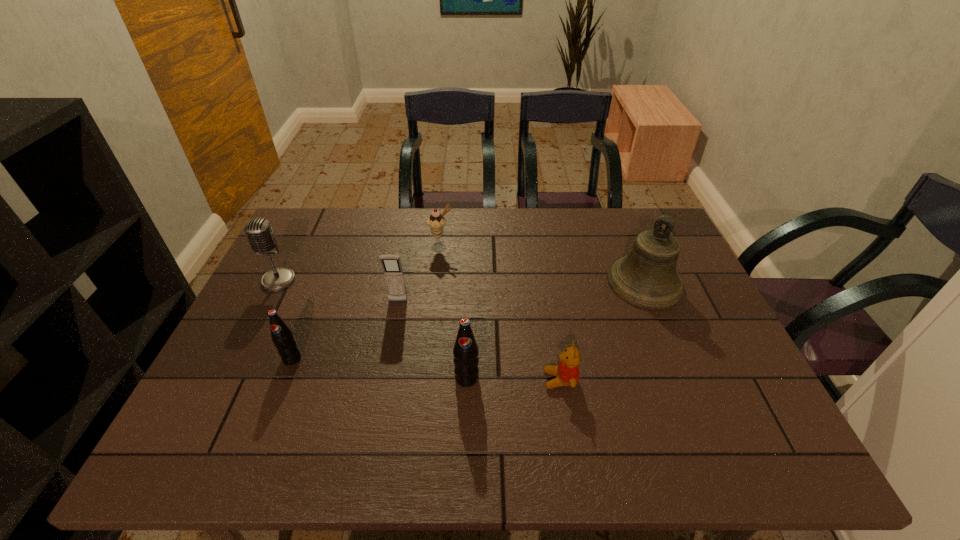
Identify the location of vacant region between the bell and the fourth object from right to left. The height and width of the screenshot is (540, 960). (542, 265).

Locate an element on the screen. This screenshot has width=960, height=540. free space between the shortest object and the rightmost object is located at coordinates (602, 331).

At what (x,y) coordinates should I click in order to perform the action: click on free spot between the farthest object and the nearer pop. Please return your answer as a coordinate pair (x, y). Looking at the image, I should click on (454, 313).

Locate an element on the screen. vacant space in between the bell and the farthest object is located at coordinates (542, 265).

Image resolution: width=960 pixels, height=540 pixels. I want to click on free space between the left pop and the fifth object from right to left, so click(x=345, y=330).

In order to click on vacant area that lies between the second object from right to left and the rightmost object in this screenshot , I will do `click(602, 331)`.

I want to click on vacant space in between the right pop and the leftmost object, so click(x=372, y=329).

The height and width of the screenshot is (540, 960). Identify the location of free space between the fourth object from left to right and the second object from right to left. pos(500,313).

At what (x,y) coordinates should I click in order to perform the action: click on the third closest object relative to the sixth object from left to right. Please return your answer as a coordinate pair (x, y). Looking at the image, I should click on (393, 272).

Point out which object is positioned as the nearest to the rightmost object. Please provide its 2D coordinates. Your answer should be formatted as a tuple, i.e. [(x, y)], where the tuple contains the x and y coordinates of a point satisfying the conditions above.

[(567, 372)]